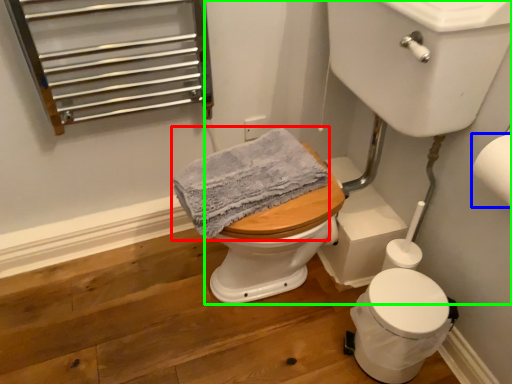
Question: Estimate the real-world distances between objects in this image. Which object is farther from bath towel (highlighted by a red box), toilet paper (highlighted by a blue box) or sink (highlighted by a green box)?

Choices:
 (A) toilet paper
 (B) sink

Answer: (A)